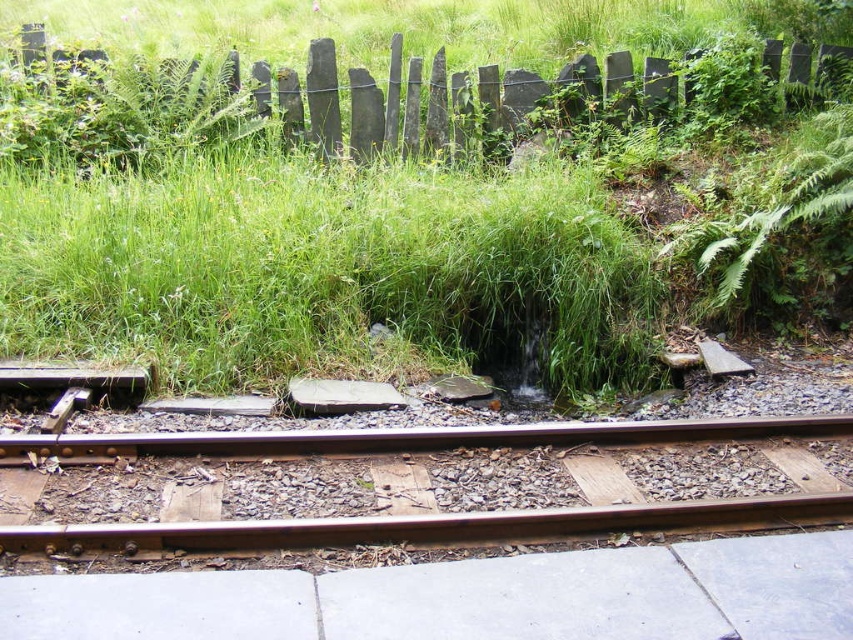
Looking at this image, you are a maintenance worker assessing the railway. You see the brown wooden train track at center and the rusty metal fence at upper center. Which object is shorter in height?

Result: The brown wooden train track at center is not as tall as the rusty metal fence at upper center, so the brown wooden train track at center is shorter in height.

You are a maintenance worker inspecting the railway track. You notice the green grass at center and the rusty metal fence at upper center. Which object is closer to the camera based on their positions?

The green grass at center is positioned under the rusty metal fence at upper center, meaning the fence is closer to the camera than the grass.